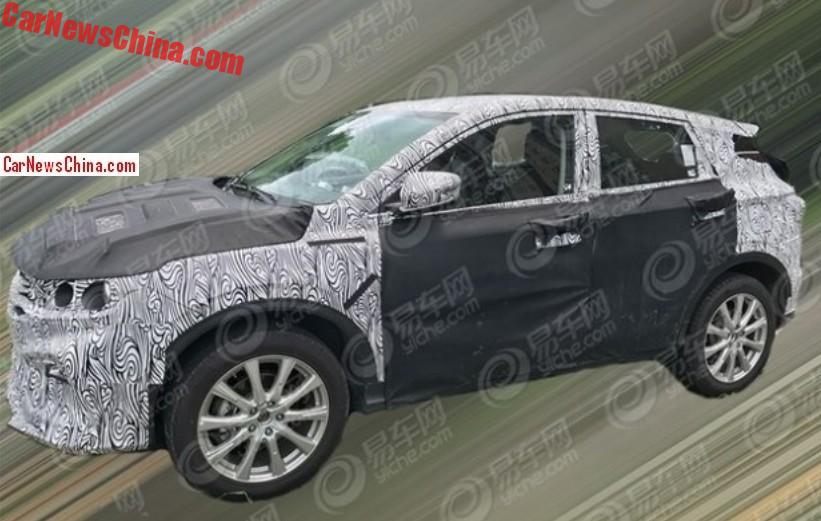
Locate an element on the screen. windows is located at coordinates (521, 156), (620, 147).